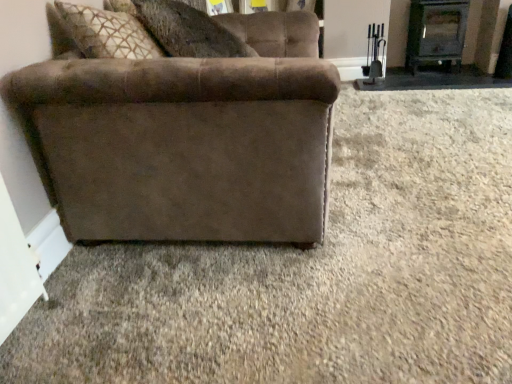
Question: Is suede brown couch at left closer to the viewer compared to suede-like brown pillow at upper center?

Choices:
 (A) yes
 (B) no

Answer: (A)

Question: From a real-world perspective, is suede brown couch at left below suede-like brown pillow at upper center?

Choices:
 (A) no
 (B) yes

Answer: (B)

Question: Considering the relative sizes of suede brown couch at left and suede-like brown pillow at upper center in the image provided, is suede brown couch at left smaller than suede-like brown pillow at upper center?

Choices:
 (A) no
 (B) yes

Answer: (A)

Question: Is suede brown couch at left facing towards suede-like brown pillow at upper center?

Choices:
 (A) no
 (B) yes

Answer: (A)

Question: From the image's perspective, is suede brown couch at left below suede-like brown pillow at upper center?

Choices:
 (A) yes
 (B) no

Answer: (A)

Question: Does point coord(450,51) appear closer or farther from the camera than point coord(244,43)?

Choices:
 (A) farther
 (B) closer

Answer: (A)

Question: Is black metal fireplace at upper right in front of or behind suede-like brown pillow at upper center in the image?

Choices:
 (A) front
 (B) behind

Answer: (B)

Question: Looking at their shapes, would you say black metal fireplace at upper right is wider or thinner than suede-like brown pillow at upper center?

Choices:
 (A) wide
 (B) thin

Answer: (B)

Question: Considering the positions of black metal fireplace at upper right and suede-like brown pillow at upper center in the image, is black metal fireplace at upper right bigger or smaller than suede-like brown pillow at upper center?

Choices:
 (A) big
 (B) small

Answer: (B)

Question: Is suede brown couch at left wider or thinner than black metal fireplace at upper right?

Choices:
 (A) thin
 (B) wide

Answer: (B)

Question: Considering the positions of suede brown couch at left and black metal fireplace at upper right in the image, is suede brown couch at left taller or shorter than black metal fireplace at upper right?

Choices:
 (A) short
 (B) tall

Answer: (B)

Question: From a real-world perspective, is suede brown couch at left above or below black metal fireplace at upper right?

Choices:
 (A) below
 (B) above

Answer: (B)

Question: From the image's perspective, is suede brown couch at left above or below black metal fireplace at upper right?

Choices:
 (A) below
 (B) above

Answer: (A)

Question: In terms of size, does suede-like brown pillow at upper center appear bigger or smaller than suede brown couch at left?

Choices:
 (A) small
 (B) big

Answer: (A)

Question: Which is correct: suede-like brown pillow at upper center is inside suede brown couch at left, or outside of it?

Choices:
 (A) outside
 (B) inside

Answer: (B)